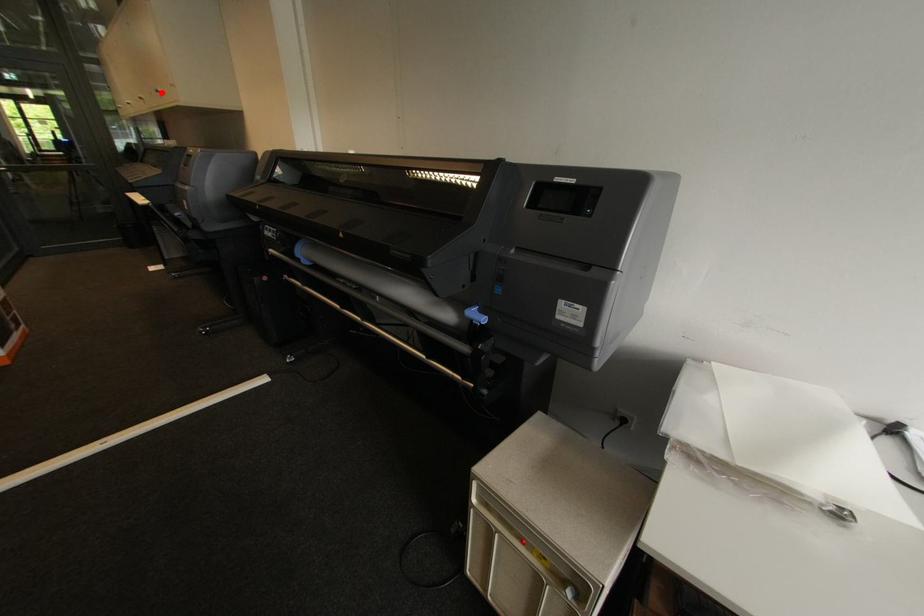
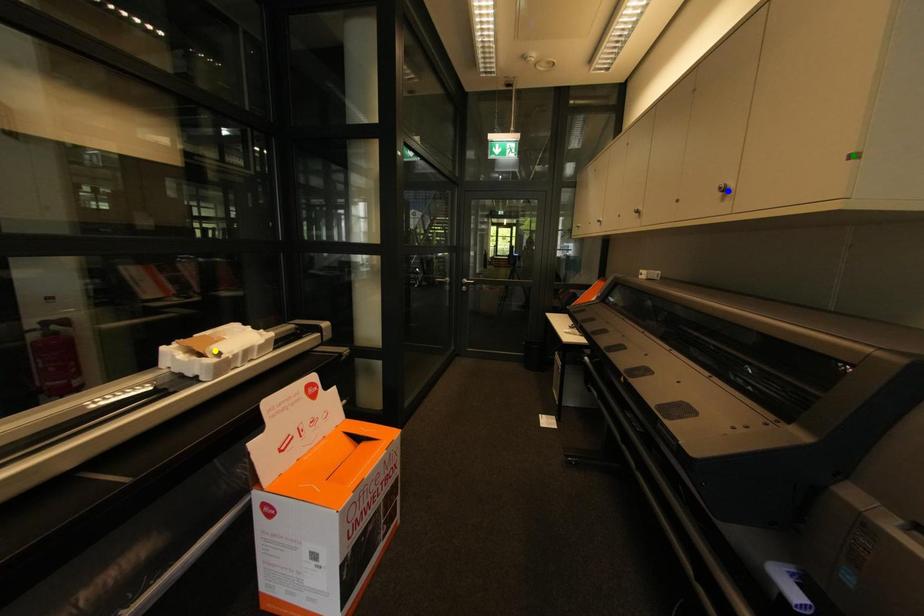
Question: I am providing you with two images of the same scene from different viewpoints. A red point is marked on the first image. You are given multiple points on the second image. In image 2, which mark is for the same physical point as the one in image 1?

Choices:
 (A) green point
 (B) blue point
 (C) yellow point

Answer: (B)